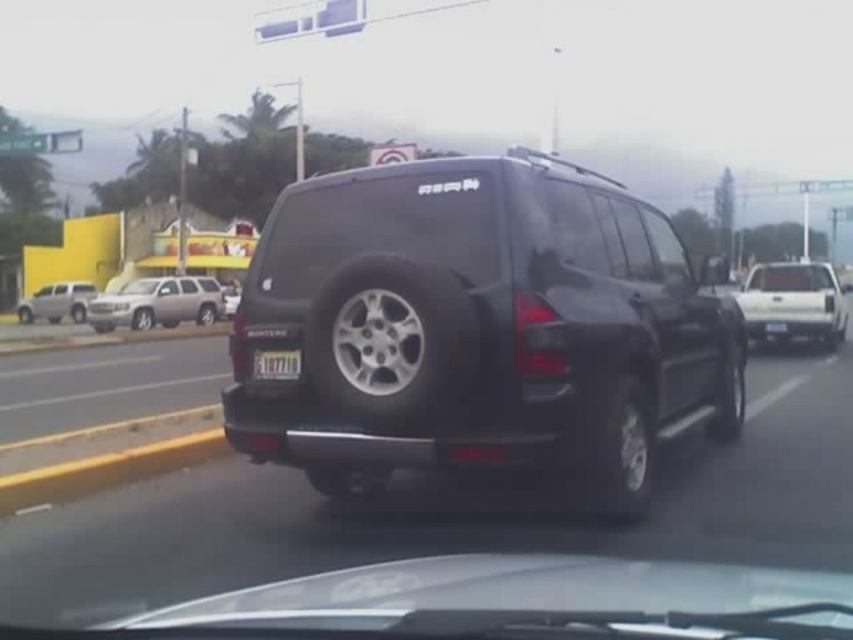
Which is behind, point (601, 241) or point (171, 284)?

The point (171, 284) is behind.

Is transparent glass windshield at center to the right of satin silver suv at left from the viewer's perspective?

Correct, you'll find transparent glass windshield at center to the right of satin silver suv at left.

Between point (601, 269) and point (207, 294), which one is positioned behind?

Positioned behind is point (207, 294).

At what (x,y) coordinates should I click in order to perform the action: click on transparent glass windshield at center. Please return your answer as a coordinate pair (x, y). Looking at the image, I should click on (612, 234).

Can you confirm if matte black minivan at center is thinner than silver metallic suv at left?

No.

Can you confirm if matte black minivan at center is positioned below silver metallic suv at left?

Correct, matte black minivan at center is located below silver metallic suv at left.

What do you see at coordinates (477, 326) in the screenshot? I see `matte black minivan at center` at bounding box center [477, 326].

Image resolution: width=853 pixels, height=640 pixels. Identify the location of matte black minivan at center. (477, 326).

Is transparent glass windshield at center bigger than white plastic license plate at center?

Correct, transparent glass windshield at center is larger in size than white plastic license plate at center.

Between transparent glass windshield at center and white plastic license plate at center, which one is positioned higher?

transparent glass windshield at center is higher up.

The height and width of the screenshot is (640, 853). Identify the location of transparent glass windshield at center. (612, 234).

Locate an element on the screen. This screenshot has height=640, width=853. transparent glass windshield at center is located at coordinates (612, 234).